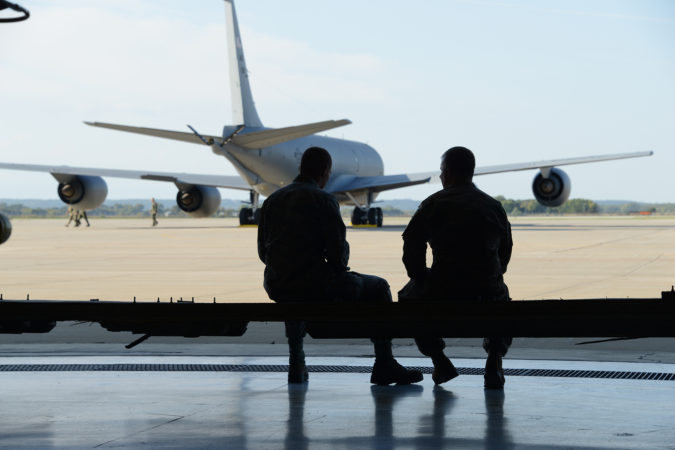
Locate an element on the screen. Image resolution: width=675 pixels, height=450 pixels. floor is located at coordinates (231, 380).